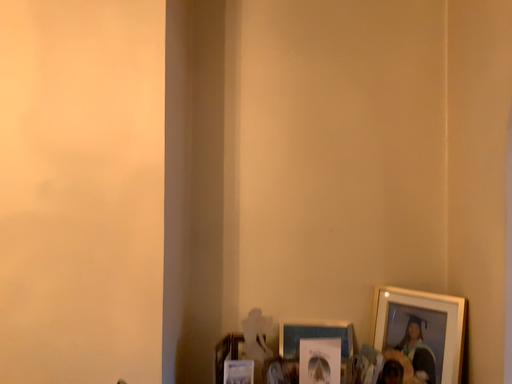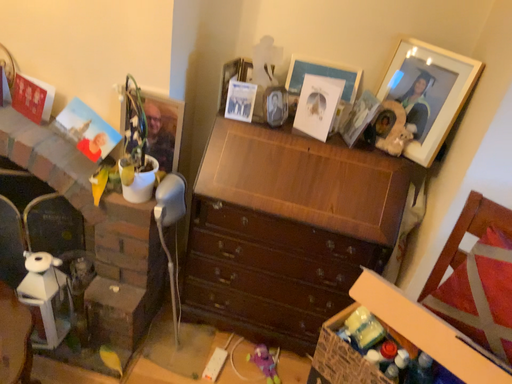
Question: Which way did the camera rotate in the video?

Choices:
 (A) rotated left
 (B) rotated right

Answer: (A)